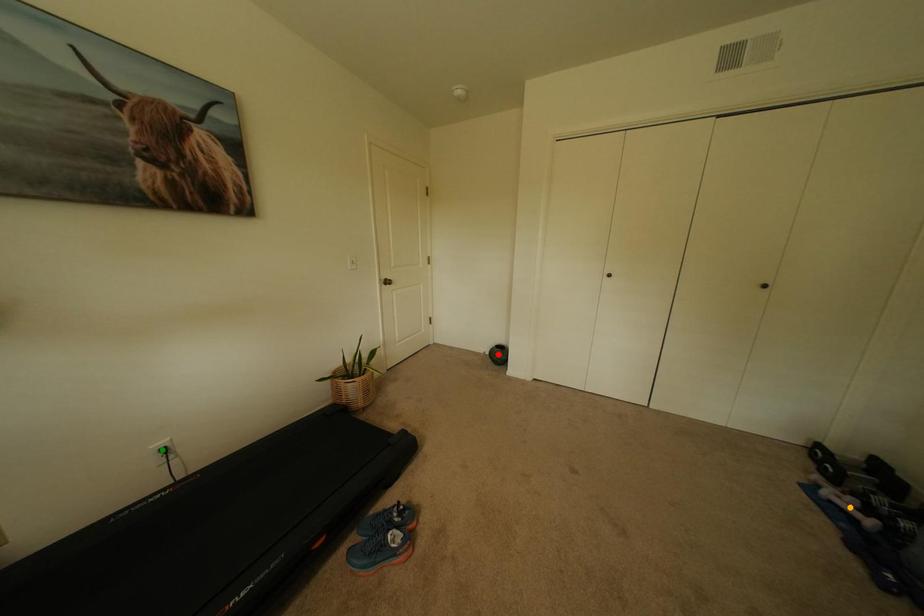
Order these from nearest to farthest:
orange point | red point | green point

orange point < green point < red point